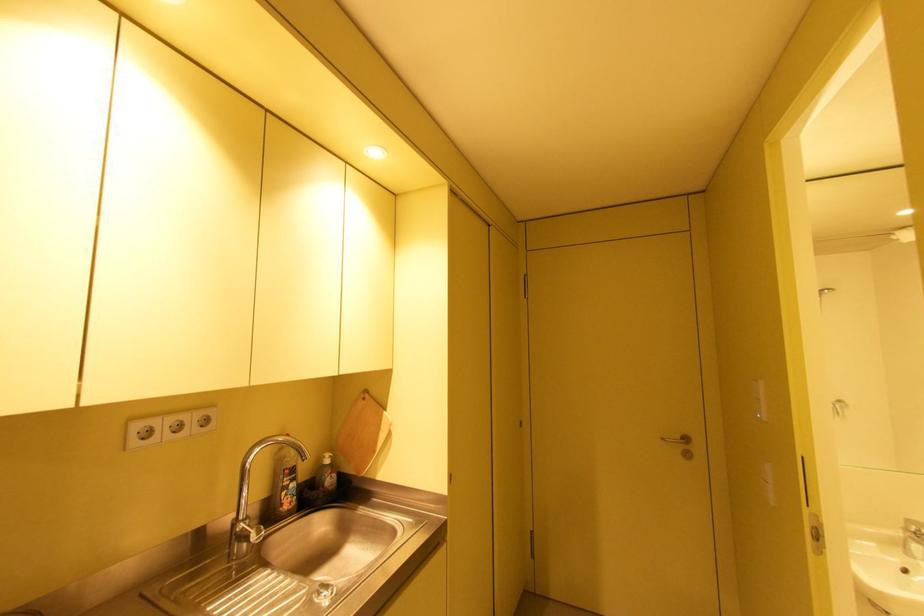
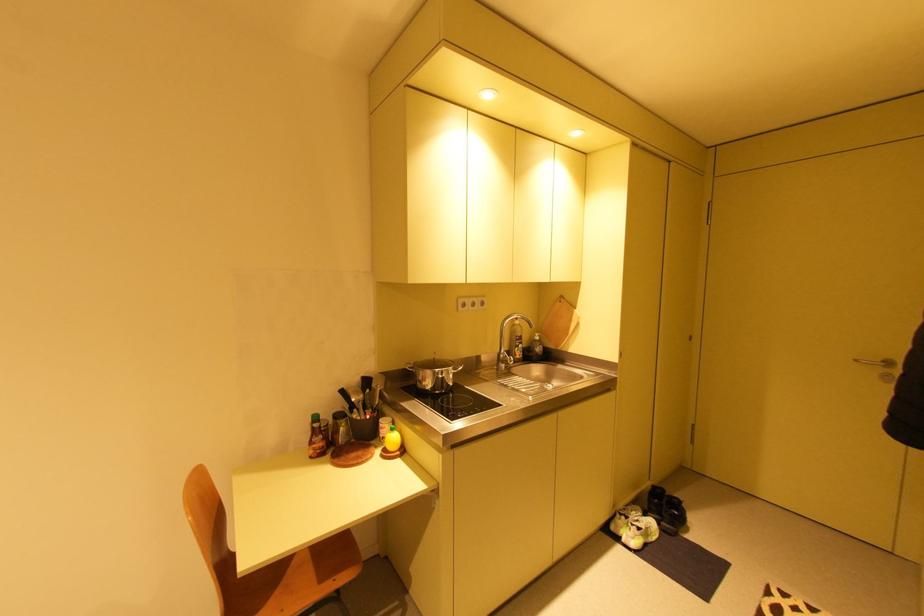
Locate, in the second image, the point that corresponds to point (330, 458) in the first image.

(541, 336)